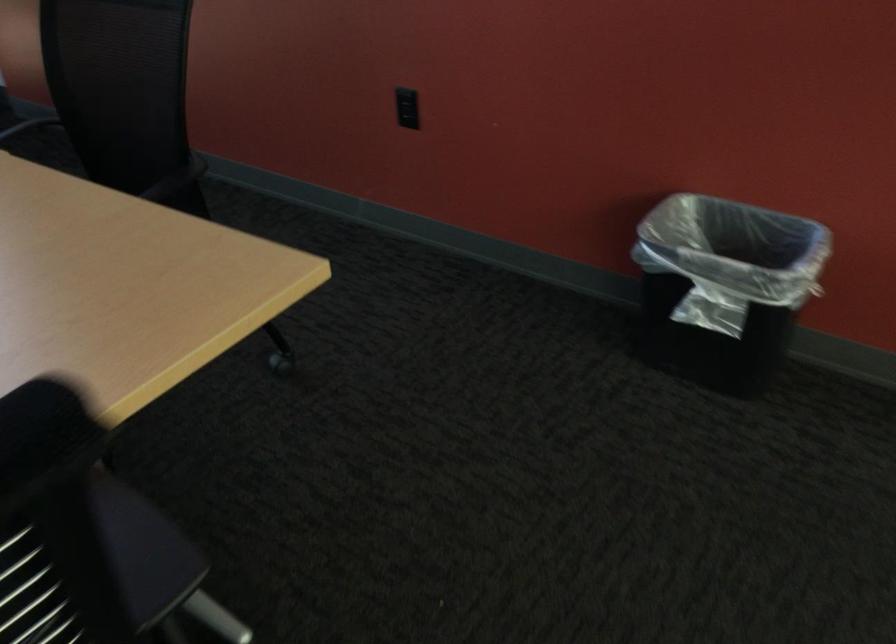
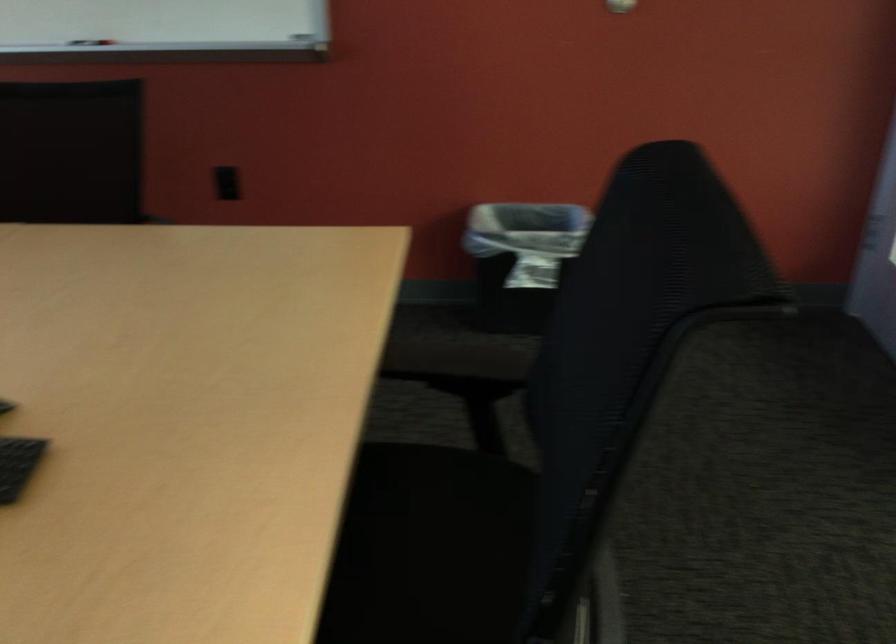
Where in the second image is the point corresponding to point 686,303 from the first image?

(521, 260)